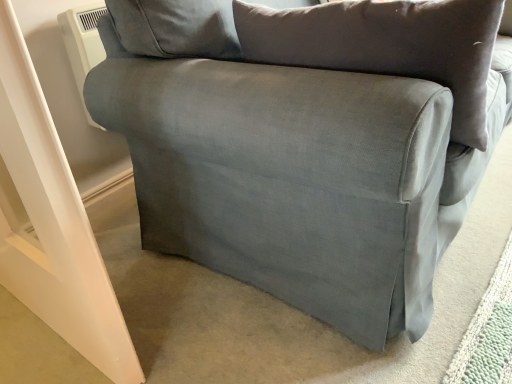
You are a GUI agent. You are given a task and a screenshot of the screen. Output one action in this format:
    pyautogui.click(x=<x>, y=<y>)
    Task: Click on the suede-like gray pillow at center
    This screenshot has width=512, height=384.
    Given the screenshot: What is the action you would take?
    pyautogui.click(x=387, y=46)

The image size is (512, 384). What do you see at coordinates (387, 46) in the screenshot? I see `suede-like gray pillow at center` at bounding box center [387, 46].

Locate an element on the screen. suede-like gray pillow at center is located at coordinates (387, 46).